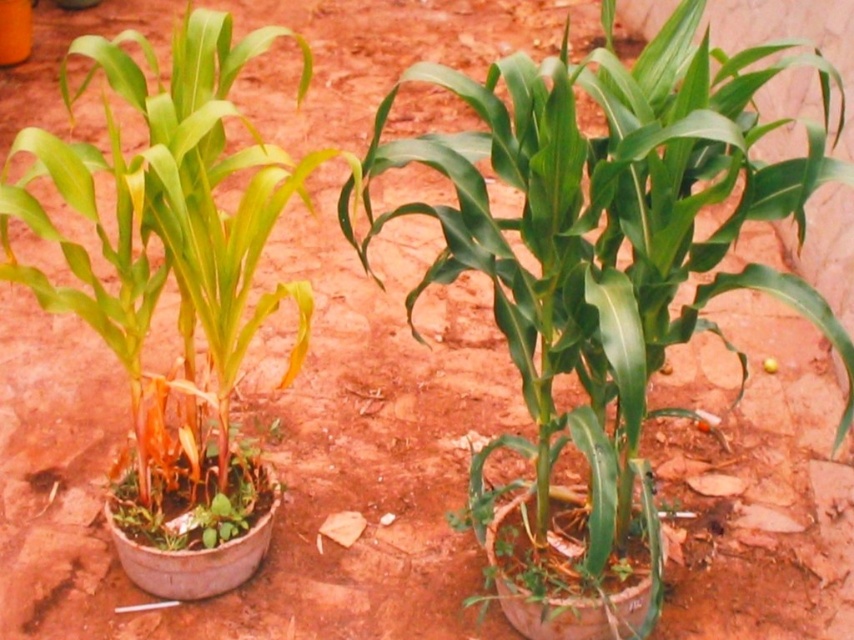
You are standing at the origin point of the coordinate system. You want to walk to the green leafy plant at center. Which direction should you move in to reach it?

You should move towards the point with coordinates approximately 0.369 in the x direction and 0.713 in the y direction to reach the green leafy plant at center.

You are standing at the point marked by the coordinates point (841, 422). You want to walk to the nearest exit, which is located 2 meters away from your current position. Is the exit within your reach?

The point (841, 422) and viewer are 1.72 meters apart from each other. Since the exit is 2 meters away from your current position, the exit is within reach as 2 meters is greater than the 1.72 meters distance between you and the viewer.

You are a gardener who wants to plant a new flower in the soil between the green leafy plant at center and the green matte plant at center. Which plant should you move to make space, considering their sizes?

The green leafy plant at center is smaller than the green matte plant at center, so you should move the green leafy plant at center to make space.